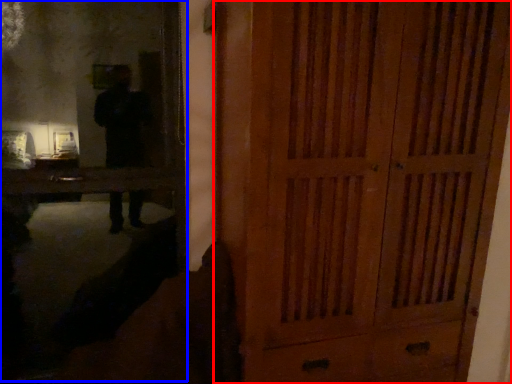
Question: Which of the following is the farthest to the observer, door (highlighted by a red box) or mirror (highlighted by a blue box)?

Choices:
 (A) door
 (B) mirror

Answer: (B)